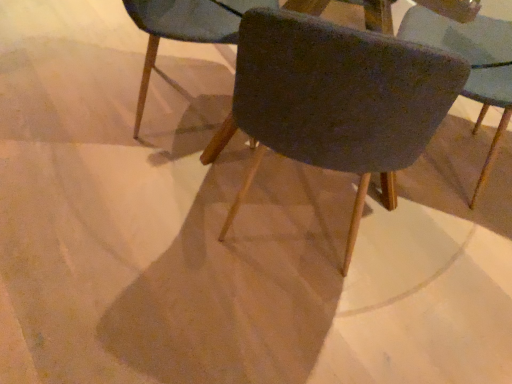
Image resolution: width=512 pixels, height=384 pixels. I want to click on free space to the left of velvet dark blue chair at center, the 3th chair from the right, so click(x=70, y=91).